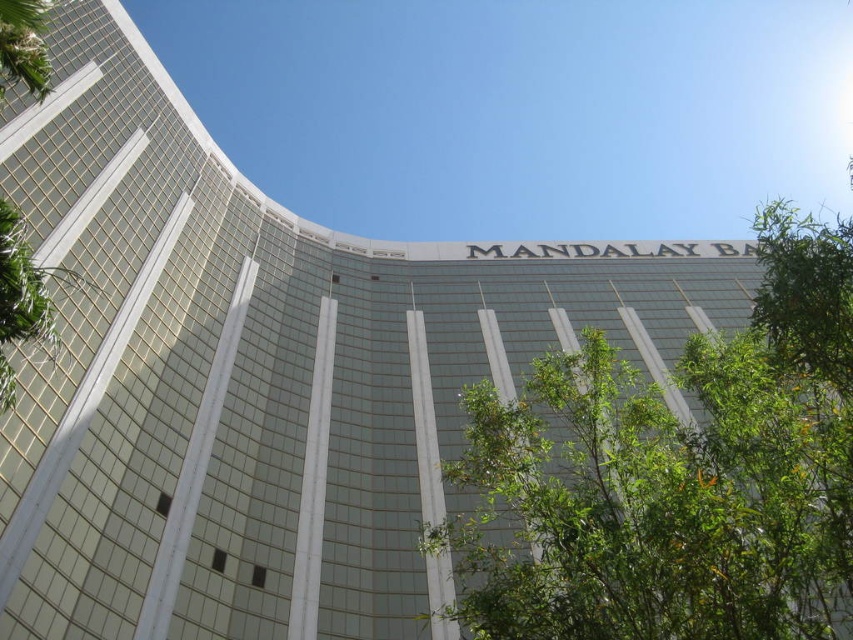
Question: Which of the following is the closest to the observer?

Choices:
 (A) (711, 388)
 (B) (9, 26)

Answer: (A)

Question: Can you confirm if green leafy tree at center is positioned above green leafy tree at left?

Choices:
 (A) yes
 (B) no

Answer: (B)

Question: Which point is farther to the camera?

Choices:
 (A) green leafy tree at left
 (B) green leafy tree at center

Answer: (A)

Question: Is green leafy tree at center behind green leafy tree at left?

Choices:
 (A) yes
 (B) no

Answer: (B)

Question: Does green leafy tree at center lie behind green leafy tree at left?

Choices:
 (A) no
 (B) yes

Answer: (A)